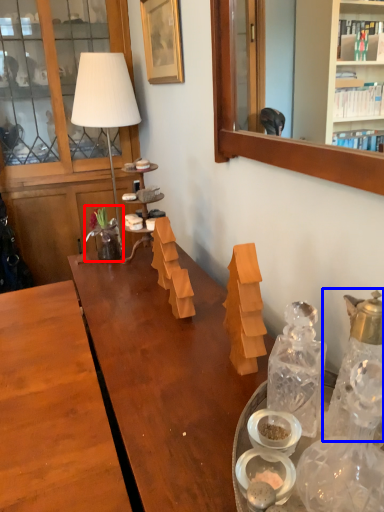
Question: Which object appears farthest to the camera in this image, flower (highlighted by a red box) or bottle (highlighted by a blue box)?

Choices:
 (A) flower
 (B) bottle

Answer: (A)